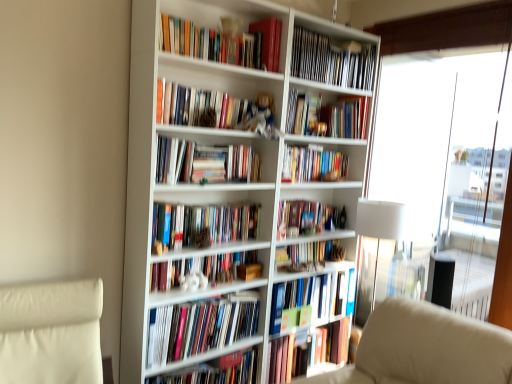
Question: Could shiny gold ornament at upper center, marked as the 3th book in a top-to-bottom arrangement, be considered to be inside hardcover books at upper center, acting as the 1th book starting from the top?

Choices:
 (A) no
 (B) yes

Answer: (A)

Question: Does hardcover books at upper center, arranged as the 13th book when ordered from the bottom, come behind shiny gold ornament at upper center, marked as the 11th book in a bottom-to-top arrangement?

Choices:
 (A) yes
 (B) no

Answer: (B)

Question: From the image's perspective, is hardcover books at upper center, arranged as the 13th book when ordered from the bottom, located above shiny gold ornament at upper center, marked as the 11th book in a bottom-to-top arrangement?

Choices:
 (A) no
 (B) yes

Answer: (B)

Question: Is hardcover books at upper center, arranged as the 13th book when ordered from the bottom, not within shiny gold ornament at upper center, marked as the 11th book in a bottom-to-top arrangement?

Choices:
 (A) yes
 (B) no

Answer: (A)

Question: From a real-world perspective, is hardcover books at upper center, arranged as the 13th book when ordered from the bottom, positioned under shiny gold ornament at upper center, marked as the 11th book in a bottom-to-top arrangement, based on gravity?

Choices:
 (A) yes
 (B) no

Answer: (B)

Question: In the image, is matte brown book at center, the twelfth book viewed from the top, positioned in front of or behind hardcover book at center, which is the 13th book from top to bottom?

Choices:
 (A) front
 (B) behind

Answer: (B)

Question: From the image's perspective, is matte brown book at center, which ranks as the second book in bottom-to-top order, above or below hardcover book at center, the 1th book from the bottom?

Choices:
 (A) below
 (B) above

Answer: (B)

Question: Considering the positions of matte brown book at center, the twelfth book viewed from the top, and hardcover book at center, the 1th book from the bottom, in the image, is matte brown book at center, the twelfth book viewed from the top, wider or thinner than hardcover book at center, the 1th book from the bottom,?

Choices:
 (A) thin
 (B) wide

Answer: (A)

Question: Is matte brown book at center, the twelfth book viewed from the top, to the left or to the right of hardcover book at center, the 1th book from the bottom, in the image?

Choices:
 (A) left
 (B) right

Answer: (B)

Question: Which is correct: hardcover book at center, the 1th book from the bottom, is inside white fabric lampshade at right, or outside of it?

Choices:
 (A) outside
 (B) inside

Answer: (A)

Question: Looking at their shapes, would you say hardcover book at center, which is the 13th book from top to bottom, is wider or thinner than white fabric lampshade at right?

Choices:
 (A) wide
 (B) thin

Answer: (B)

Question: Does point (181, 379) appear closer or farther from the camera than point (359, 198)?

Choices:
 (A) farther
 (B) closer

Answer: (B)

Question: Based on their positions, is hardcover book at center, the 1th book from the bottom, located to the left or right of white fabric lampshade at right?

Choices:
 (A) right
 (B) left

Answer: (B)

Question: Does point (471, 208) appear closer or farther from the camera than point (203, 157)?

Choices:
 (A) closer
 (B) farther

Answer: (B)

Question: From the image's perspective, is transparent glass window at right located above or below hardcover book at center, the first paperback book when ordered from left to right?

Choices:
 (A) above
 (B) below

Answer: (B)